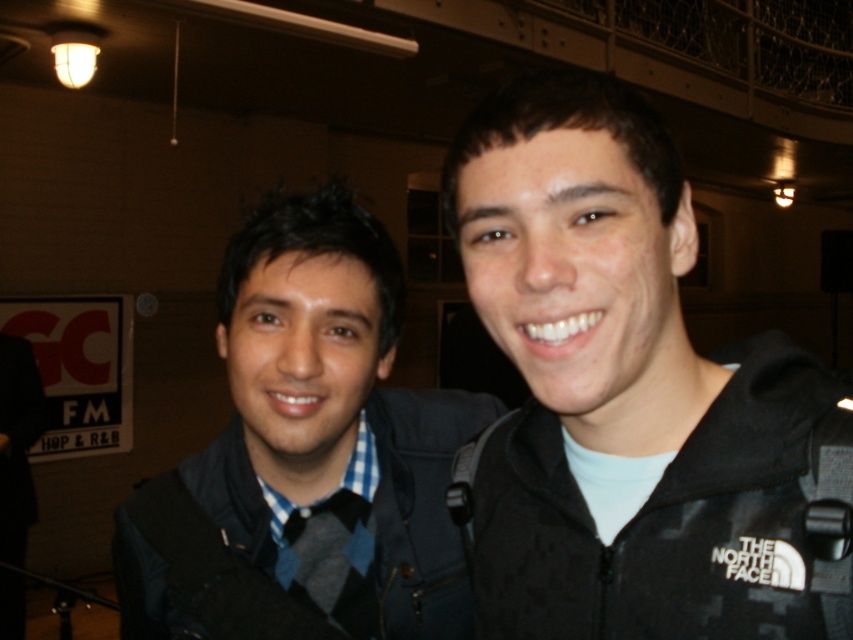
Does blue checkered shirt at center appear on the right side of black fabric jacket at right?

No, blue checkered shirt at center is not to the right of black fabric jacket at right.

Is the position of blue checkered shirt at center more distant than that of black fabric jacket at right?

Yes.

The height and width of the screenshot is (640, 853). What do you see at coordinates (310, 449) in the screenshot?
I see `blue checkered shirt at center` at bounding box center [310, 449].

Where is `blue checkered shirt at center`? This screenshot has height=640, width=853. blue checkered shirt at center is located at coordinates (310, 449).